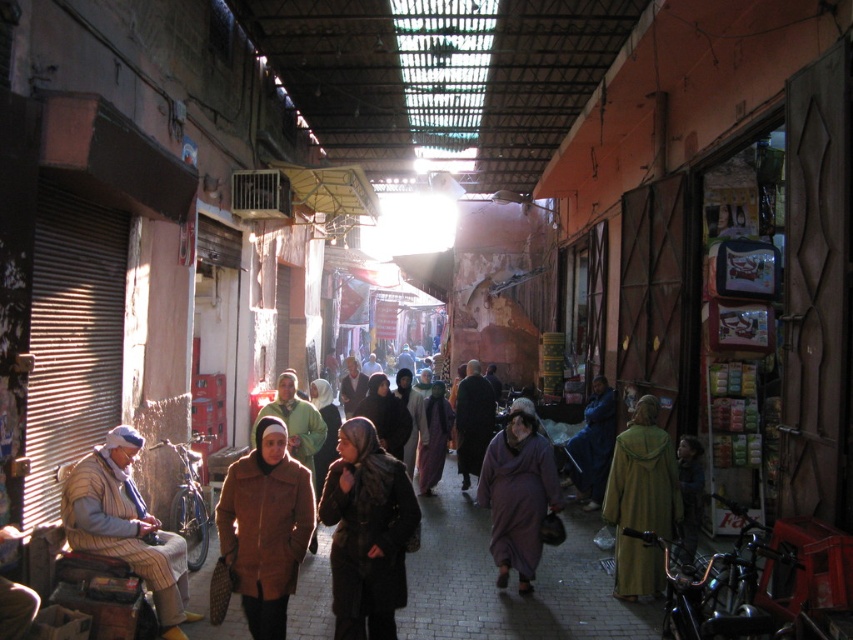
Between striped woolen vest at lower left and dark brown coat at center, which one has less height?

striped woolen vest at lower left is shorter.

Between striped woolen vest at lower left and dark brown coat at center, which one is positioned lower?

striped woolen vest at lower left is below.

Identify the location of striped woolen vest at lower left. This screenshot has width=853, height=640. (126, 525).

Measure the distance from purple fabric dress at center to dark blue fabric at center.

purple fabric dress at center is 12.06 feet from dark blue fabric at center.

Is purple fabric dress at center taller than dark blue fabric at center?

No, purple fabric dress at center is not taller than dark blue fabric at center.

Describe the element at coordinates (518, 493) in the screenshot. The height and width of the screenshot is (640, 853). I see `purple fabric dress at center` at that location.

In order to click on purple fabric dress at center in this screenshot , I will do `click(518, 493)`.

Between green woolen robe at right and dark purple fabric at center, which one has less height?

Standing shorter between the two is dark purple fabric at center.

Between green woolen robe at right and dark purple fabric at center, which one is positioned higher?

Positioned higher is green woolen robe at right.

I want to click on green woolen robe at right, so click(641, 500).